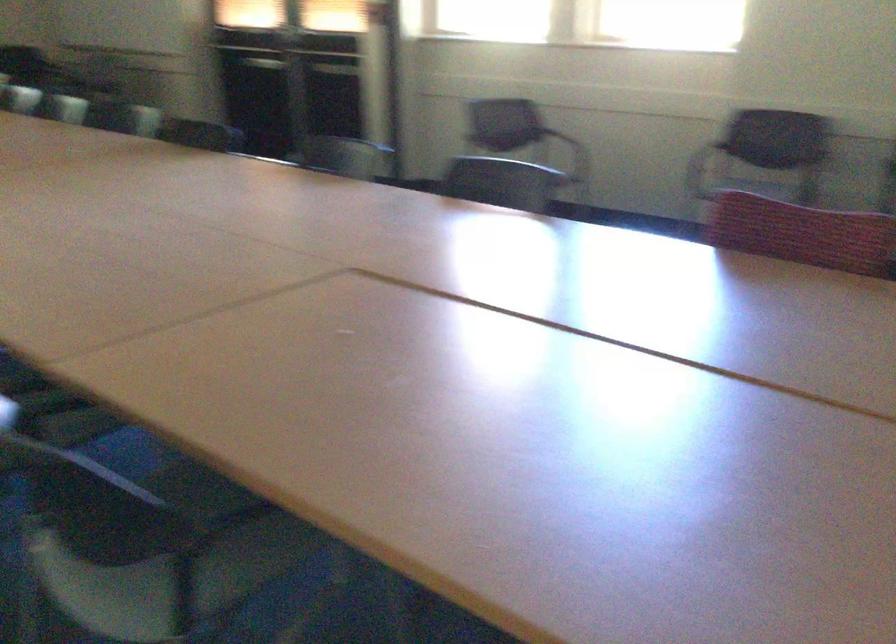
Identify the location of black chair sitting surface. The image size is (896, 644). (170, 467).